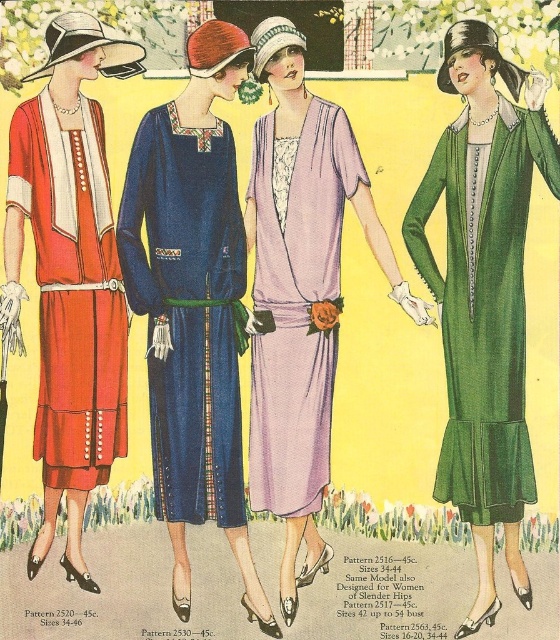
Who is more distant from viewer, (192, 58) or (72, 184)?

Point (72, 184)

Which is below, velvet blue dress at center or matte orange dress at left?

matte orange dress at left is below.

Does point (186, 592) come in front of point (44, 516)?

That is True.

Locate an element on the screen. This screenshot has height=640, width=560. velvet blue dress at center is located at coordinates (193, 305).

Does shiny green coat at right appear on the left side of lavender silk dress at center?

No, shiny green coat at right is not to the left of lavender silk dress at center.

Measure the distance between shiny green coat at right and lavender silk dress at center.

shiny green coat at right and lavender silk dress at center are 4.56 feet apart.

In order to click on shiny green coat at right in this screenshot , I will do `click(484, 294)`.

Can you confirm if shiny green coat at right is positioned to the left of lavender satin dress at center?

Incorrect, shiny green coat at right is not on the left side of lavender satin dress at center.

Who is lower down, shiny green coat at right or lavender satin dress at center?

shiny green coat at right is below.

Does point (474, 493) come closer to viewer compared to point (266, 294)?

Yes.

Find the location of a particular element. shiny green coat at right is located at coordinates (484, 294).